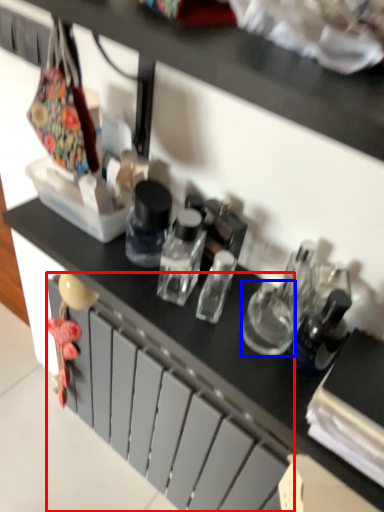
Question: Which point is further to the camera, drawer (highlighted by a red box) or bottle (highlighted by a blue box)?

Choices:
 (A) drawer
 (B) bottle

Answer: (A)